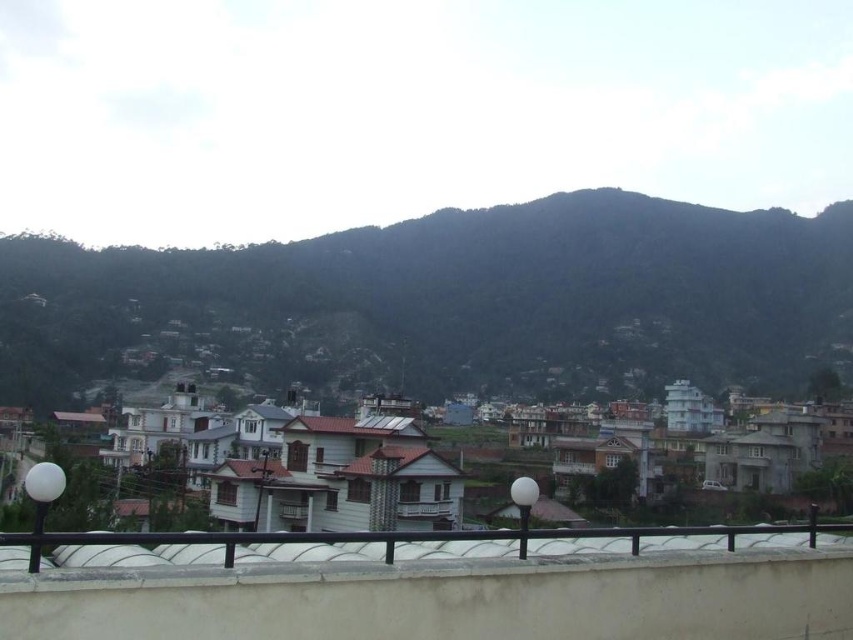
Question: Can you confirm if dark green forested mountain at upper center is positioned to the right of white matte rail at lower center?

Choices:
 (A) no
 (B) yes

Answer: (B)

Question: Which point is farther to the camera?

Choices:
 (A) white painted wooden houses at center
 (B) dark green forested mountain at upper center
 (C) white matte rail at lower center

Answer: (B)

Question: Which object is the closest to the dark green forested mountain at upper center?

Choices:
 (A) white matte rail at lower center
 (B) white painted wooden houses at center

Answer: (B)

Question: Is dark green forested mountain at upper center wider than white matte rail at lower center?

Choices:
 (A) yes
 (B) no

Answer: (A)

Question: Which point appears closest to the camera in this image?

Choices:
 (A) (820, 524)
 (B) (357, 428)

Answer: (A)

Question: Is dark green forested mountain at upper center to the left of white matte rail at lower center from the viewer's perspective?

Choices:
 (A) yes
 (B) no

Answer: (B)